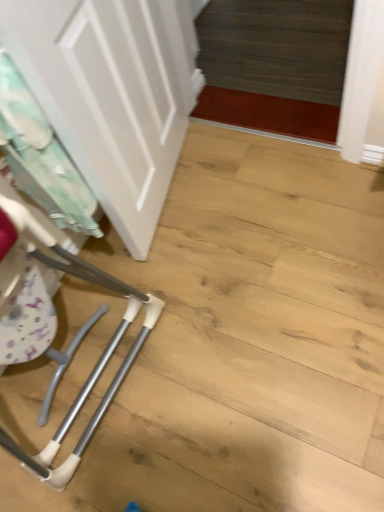
Question: Is white fabric laundry at left situated inside white matte door at upper left or outside?

Choices:
 (A) outside
 (B) inside

Answer: (B)

Question: From their relative heights in the image, would you say white fabric laundry at left is taller or shorter than white matte door at upper left?

Choices:
 (A) tall
 (B) short

Answer: (B)

Question: From a real-world perspective, relative to white matte door at upper left, is white fabric laundry at left vertically above or below?

Choices:
 (A) above
 (B) below

Answer: (B)

Question: Is white matte door at upper left taller or shorter than white fabric laundry at left?

Choices:
 (A) short
 (B) tall

Answer: (B)

Question: Considering the relative positions of white matte door at upper left and white fabric laundry at left in the image provided, is white matte door at upper left to the left or to the right of white fabric laundry at left?

Choices:
 (A) right
 (B) left

Answer: (A)

Question: Is point (175, 37) closer or farther from the camera than point (51, 152)?

Choices:
 (A) farther
 (B) closer

Answer: (A)

Question: Is white matte door at upper left wider or thinner than white fabric laundry at left?

Choices:
 (A) wide
 (B) thin

Answer: (A)